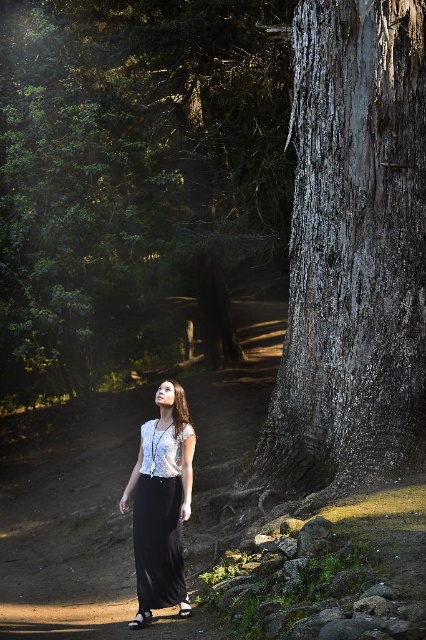
You are a hiker who wants to take a photo of the gray textured bark at center and the white lace blouse at center. Which object should you focus on first if you want both to be in clear focus?

The gray textured bark at center is larger in size than the white lace blouse at center, so you should focus on the gray textured bark at center first to ensure both are in clear focus.

The woman in the scene is standing on a dirt path in the forest. There is a point labeled as point (351, 252). What object in the scene corresponds to this point?

The gray textured bark at center corresponds to the point (351, 252).